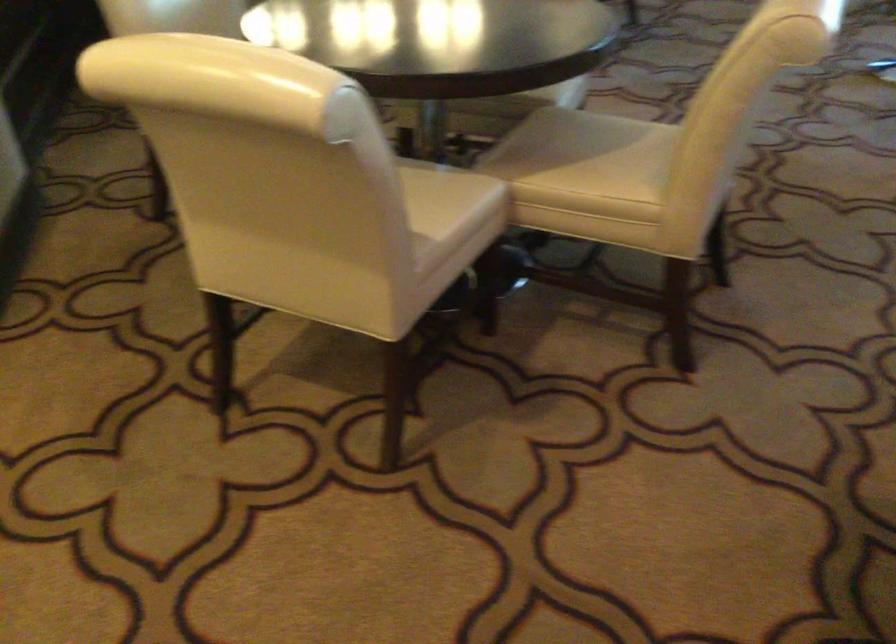
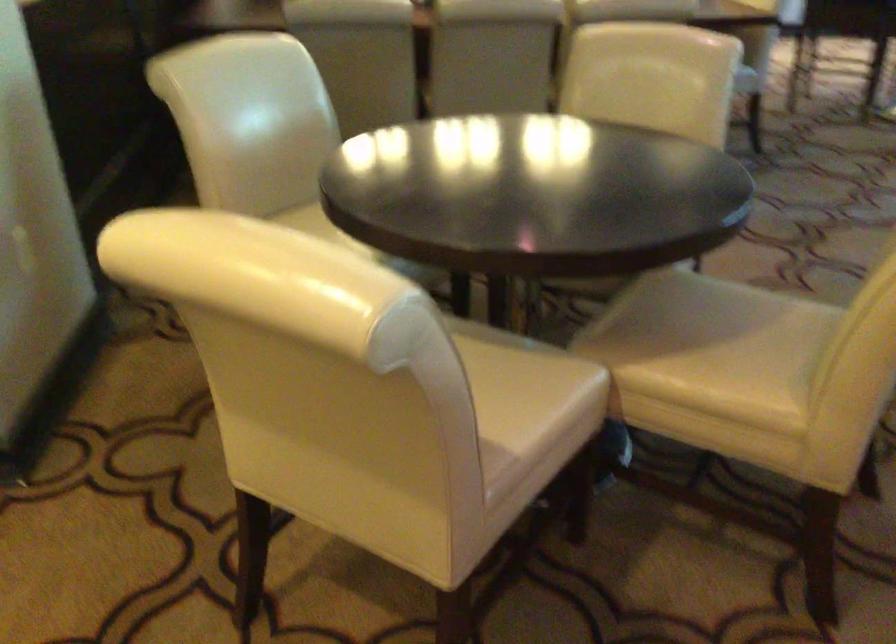
The point at (615, 147) is marked in the first image. Where is the corresponding point in the second image?

(743, 330)